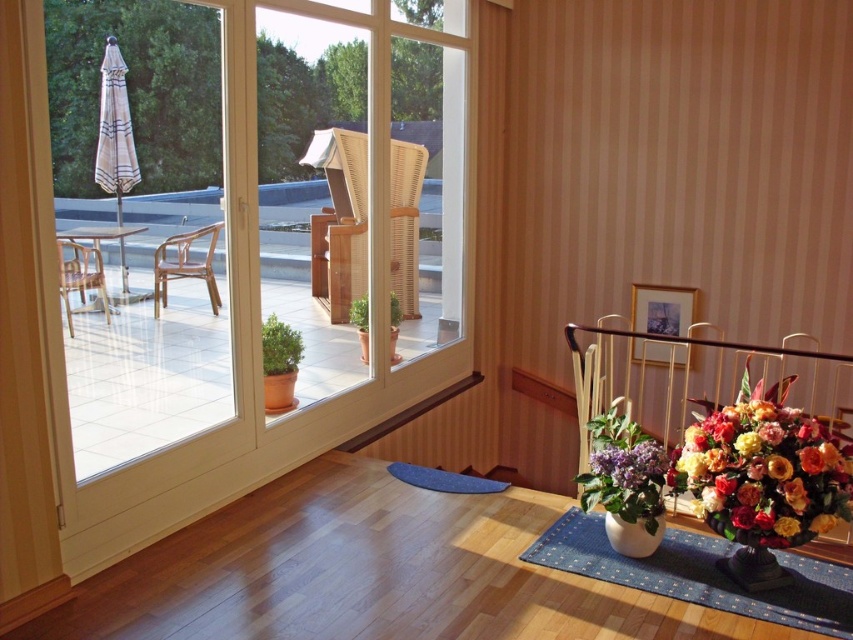
Question: Where is blue fabric mat at lower right located in relation to light brown wooden chair at left in the image?

Choices:
 (A) right
 (B) left

Answer: (A)

Question: Which of the following is the closest to the observer?

Choices:
 (A) (851, 484)
 (B) (65, 307)
 (C) (567, 522)
 (D) (225, 433)

Answer: (A)

Question: Does transparent glass door at center have a greater width compared to wooden chair at left?

Choices:
 (A) no
 (B) yes

Answer: (B)

Question: Which point appears closest to the camera in this image?

Choices:
 (A) (730, 461)
 (B) (700, 474)
 (C) (183, 252)

Answer: (A)

Question: Can you confirm if blue fabric mat at lower right is positioned above light brown wooden chair at left?

Choices:
 (A) yes
 (B) no

Answer: (B)

Question: Which of the following is the closest to the observer?

Choices:
 (A) click(807, 525)
 (B) click(604, 536)
 (C) click(173, 262)

Answer: (A)